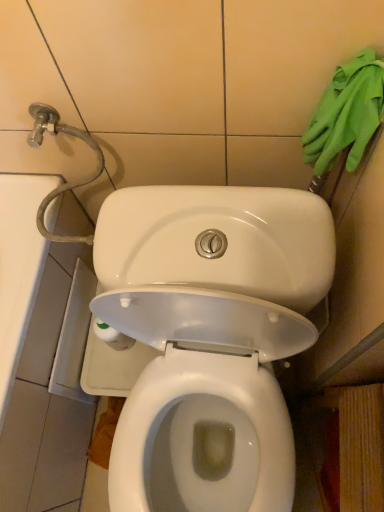
Question: Are white glossy toilet at center and green rubber gloves at upper right located far from each other?

Choices:
 (A) no
 (B) yes

Answer: (A)

Question: Considering the relative positions of white glossy toilet at center and green rubber gloves at upper right in the image provided, is white glossy toilet at center to the left of green rubber gloves at upper right from the viewer's perspective?

Choices:
 (A) yes
 (B) no

Answer: (A)

Question: Does white glossy toilet at center have a greater width compared to green rubber gloves at upper right?

Choices:
 (A) no
 (B) yes

Answer: (B)

Question: Is white glossy toilet at center behind green rubber gloves at upper right?

Choices:
 (A) yes
 (B) no

Answer: (B)

Question: Is white glossy toilet at center next to green rubber gloves at upper right?

Choices:
 (A) no
 (B) yes

Answer: (A)

Question: From the image's perspective, is white glossy toilet at center under green rubber gloves at upper right?

Choices:
 (A) no
 (B) yes

Answer: (B)

Question: Is green rubber gloves at upper right taller than white glossy toilet at center?

Choices:
 (A) yes
 (B) no

Answer: (B)

Question: Is green rubber gloves at upper right outside white glossy toilet at center?

Choices:
 (A) yes
 (B) no

Answer: (A)

Question: Is the surface of green rubber gloves at upper right in direct contact with white glossy toilet at center?

Choices:
 (A) yes
 (B) no

Answer: (B)

Question: Considering the relative positions of green rubber gloves at upper right and white glossy toilet at center in the image provided, is green rubber gloves at upper right to the left of white glossy toilet at center from the viewer's perspective?

Choices:
 (A) no
 (B) yes

Answer: (A)

Question: From the image's perspective, does green rubber gloves at upper right appear higher than white glossy toilet at center?

Choices:
 (A) no
 (B) yes

Answer: (B)

Question: Is green rubber gloves at upper right thinner than white glossy toilet at center?

Choices:
 (A) yes
 (B) no

Answer: (A)

Question: From the image's perspective, is white glossy toilet at center located above or below green rubber gloves at upper right?

Choices:
 (A) above
 (B) below

Answer: (B)